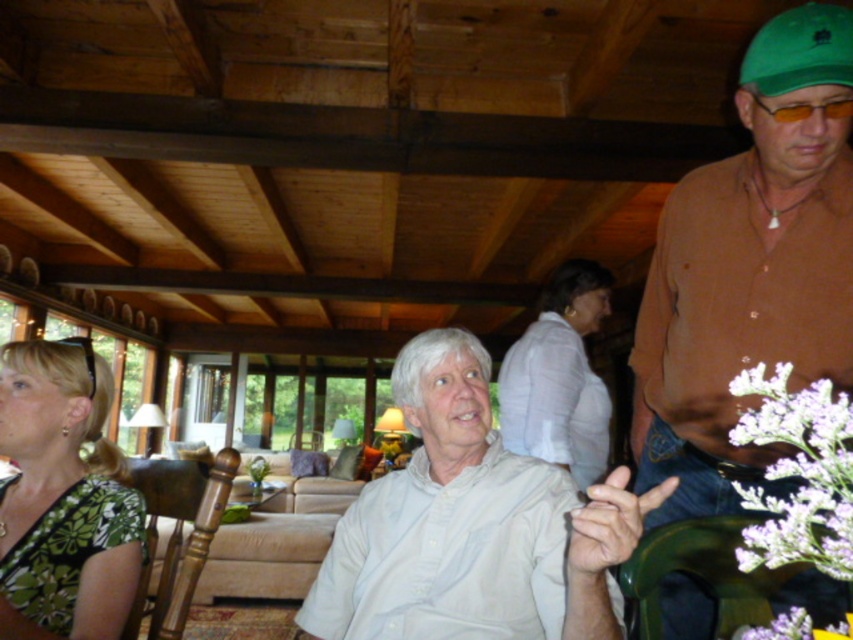
Can you confirm if purple fluffy flower at right is smaller than white textured blouse at center?

Correct, purple fluffy flower at right occupies less space than white textured blouse at center.

Is purple fluffy flower at right to the left of white textured blouse at center from the viewer's perspective?

In fact, purple fluffy flower at right is to the right of white textured blouse at center.

Locate an element on the screen. The width and height of the screenshot is (853, 640). purple fluffy flower at right is located at coordinates (798, 474).

Between point (4, 490) and point (558, 435), which one is positioned in front?

Positioned in front is point (4, 490).

Which of these two, green floral dress at left or white textured blouse at center, stands taller?

white textured blouse at center is taller.

Who is more distant from viewer, (38, 480) or (550, 284)?

Positioned behind is point (550, 284).

Find the location of a particular element. green floral dress at left is located at coordinates (62, 497).

Measure the distance between point (469, 376) and camera.

The distance of point (469, 376) from camera is 3.78 feet.

Does white cotton shirt at center have a lesser height compared to green floral dress at left?

No, white cotton shirt at center is not shorter than green floral dress at left.

Is point (456, 364) farther from viewer compared to point (51, 497)?

No, (456, 364) is in front of (51, 497).

Where is `white cotton shirt at center`? This screenshot has height=640, width=853. white cotton shirt at center is located at coordinates (469, 525).